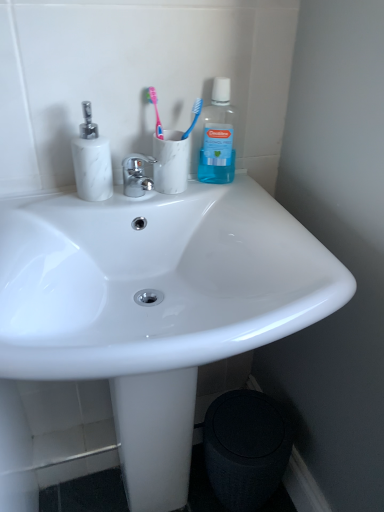
Question: Should I look upward or downward to see pink plastic toothbrush at upper center, which is the 1th toothbrush in left-to-right order?

Choices:
 (A) down
 (B) up

Answer: (B)

Question: Is white glossy sink at center at the back of black textured trash bin/can at lower right?

Choices:
 (A) yes
 (B) no

Answer: (A)

Question: Can you confirm if black textured trash bin/can at lower right is positioned to the right of white glossy sink at center?

Choices:
 (A) yes
 (B) no

Answer: (A)

Question: From the image's perspective, is black textured trash bin/can at lower right on top of white glossy sink at center?

Choices:
 (A) no
 (B) yes

Answer: (A)

Question: From a real-world perspective, does black textured trash bin/can at lower right sit lower than white glossy sink at center?

Choices:
 (A) yes
 (B) no

Answer: (A)

Question: Is black textured trash bin/can at lower right thinner than white glossy sink at center?

Choices:
 (A) no
 (B) yes

Answer: (B)

Question: Does black textured trash bin/can at lower right have a greater width compared to white glossy sink at center?

Choices:
 (A) yes
 (B) no

Answer: (B)

Question: Is transparent plastic mouthwash at upper right further to camera compared to white marble toothbrush holder at upper center?

Choices:
 (A) no
 (B) yes

Answer: (B)

Question: Is transparent plastic mouthwash at upper right placed right next to white marble toothbrush holder at upper center?

Choices:
 (A) yes
 (B) no

Answer: (B)

Question: Can you confirm if transparent plastic mouthwash at upper right is smaller than white marble toothbrush holder at upper center?

Choices:
 (A) no
 (B) yes

Answer: (B)

Question: Considering the relative sizes of transparent plastic mouthwash at upper right and white marble toothbrush holder at upper center in the image provided, is transparent plastic mouthwash at upper right taller than white marble toothbrush holder at upper center?

Choices:
 (A) no
 (B) yes

Answer: (B)

Question: From the image's perspective, is transparent plastic mouthwash at upper right under white marble toothbrush holder at upper center?

Choices:
 (A) no
 (B) yes

Answer: (A)

Question: From the image's perspective, is transparent plastic mouthwash at upper right above white marble toothbrush holder at upper center?

Choices:
 (A) no
 (B) yes

Answer: (B)

Question: Is transparent plastic mouthwash at upper right outside of white marble soap dispenser at left?

Choices:
 (A) yes
 (B) no

Answer: (A)